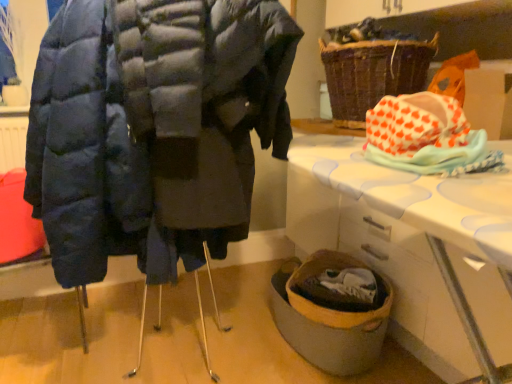
Where is `vacant space underneath matte blue puffer coat at left (from a real-world perspective)`? vacant space underneath matte blue puffer coat at left (from a real-world perspective) is located at coordinates (187, 348).